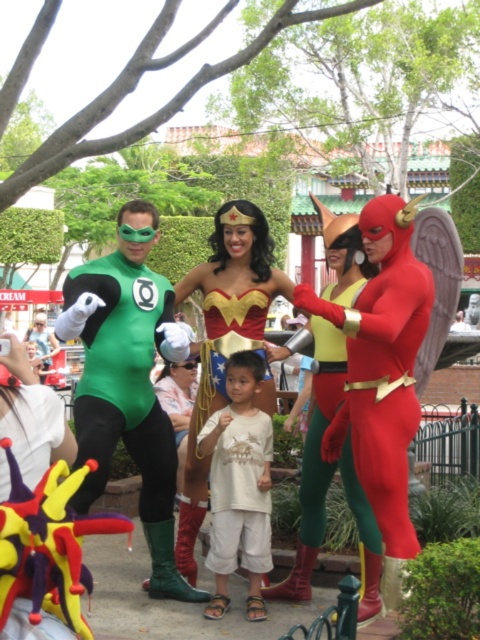
Can you confirm if shiny red suit at right is thinner than shiny gold tiara at center?

Incorrect, shiny red suit at right's width is not less than shiny gold tiara at center's.

Is point (359, 380) farther from viewer compared to point (379, 548)?

No, it is not.

Where is `shiny red suit at right`? shiny red suit at right is located at coordinates [382, 365].

Which is behind, point (117, 406) or point (444, 225)?

Positioned behind is point (444, 225).

Is green spandex suit at left positioned at the back of shiny green costume at center?

That is True.

Is point (152, 580) positioned behind point (434, 316)?

No.

Identify the location of green spandex suit at left. (128, 381).

Can you confirm if shiny gold costume at center is bigger than white cotton shirt at center?

No.

Who is taller, shiny gold costume at center or white cotton shirt at center?

white cotton shirt at center

Is point (259, 314) more distant than point (253, 440)?

Yes, it is.

Find the location of `shiny gold costume at center`. shiny gold costume at center is located at coordinates (225, 339).